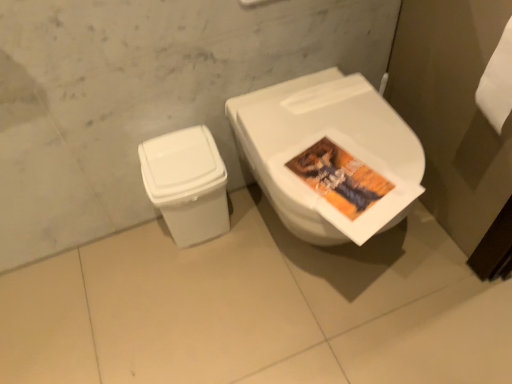
Identify the location of white glossy toilet at center. (329, 155).

Describe the element at coordinates (329, 155) in the screenshot. I see `white glossy toilet at center` at that location.

What do you see at coordinates (187, 183) in the screenshot? The height and width of the screenshot is (384, 512). I see `white plastic trash can at lower left` at bounding box center [187, 183].

In order to face white plastic trash can at lower left, should I rotate leftwards or rightwards?

Turn left by 8.027 degrees to look at white plastic trash can at lower left.

Locate an element on the screen. Image resolution: width=512 pixels, height=384 pixels. white plastic trash can at lower left is located at coordinates pyautogui.click(x=187, y=183).

Identify the location of white glossy toilet at center. This screenshot has width=512, height=384. (329, 155).

Between white glossy toilet at center and white plastic trash can at lower left, which one appears on the right side from the viewer's perspective?

white glossy toilet at center is more to the right.

In the image, is white glossy toilet at center positioned in front of or behind white plastic trash can at lower left?

Visually, white glossy toilet at center is located in front of white plastic trash can at lower left.

Which is in front, point (267, 155) or point (213, 231)?

The point (267, 155) is closer.

From the image's perspective, is white glossy toilet at center located above or below white plastic trash can at lower left?

white glossy toilet at center is situated higher than white plastic trash can at lower left in the image.

From a real-world perspective, who is located higher, white glossy toilet at center or white plastic trash can at lower left?

white glossy toilet at center.

Considering the sizes of white glossy toilet at center and white plastic trash can at lower left in the image, is white glossy toilet at center wider or thinner than white plastic trash can at lower left?

white glossy toilet at center is wider than white plastic trash can at lower left.

Consider the image. Considering the sizes of white glossy toilet at center and white plastic trash can at lower left in the image, is white glossy toilet at center taller or shorter than white plastic trash can at lower left?

white glossy toilet at center is taller than white plastic trash can at lower left.

Can you confirm if white glossy toilet at center is bigger than white plastic trash can at lower left?

Yes, white glossy toilet at center is bigger than white plastic trash can at lower left.

Choose the correct answer: Is white glossy toilet at center inside white plastic trash can at lower left or outside it?

white glossy toilet at center is not enclosed by white plastic trash can at lower left.

Is white glossy toilet at center far from white plastic trash can at lower left?

No, white glossy toilet at center is in close proximity to white plastic trash can at lower left.

From the picture: Is white glossy toilet at center facing away from white plastic trash can at lower left?

No, white glossy toilet at center's orientation is not away from white plastic trash can at lower left.

How different are the orientations of white glossy toilet at center and white plastic trash can at lower left in degrees?

white glossy toilet at center and white plastic trash can at lower left are facing 0.167 degrees away from each other.

The height and width of the screenshot is (384, 512). I want to click on toilet lying in front of the white plastic trash can at lower left, so click(x=329, y=155).

Considering the positions of objects white plastic trash can at lower left and white glossy toilet at center in the image provided, who is more to the right, white plastic trash can at lower left or white glossy toilet at center?

white glossy toilet at center.

Considering the positions of objects white plastic trash can at lower left and white glossy toilet at center in the image provided, who is in front, white plastic trash can at lower left or white glossy toilet at center?

white glossy toilet at center is closer to the camera.

Which is in front, point (217, 200) or point (334, 117)?

The point (334, 117) is closer.

From the image's perspective, is white plastic trash can at lower left under white glossy toilet at center?

Yes, from the image's perspective, white plastic trash can at lower left is below white glossy toilet at center.

From a real-world perspective, which is physically below, white plastic trash can at lower left or white glossy toilet at center?

white plastic trash can at lower left.

Looking at their sizes, would you say white plastic trash can at lower left is wider or thinner than white glossy toilet at center?

A: white plastic trash can at lower left is thinner than white glossy toilet at center.

Is white plastic trash can at lower left taller than white glossy toilet at center?

No.

Considering the relative sizes of white plastic trash can at lower left and white glossy toilet at center in the image provided, is white plastic trash can at lower left bigger than white glossy toilet at center?

No, white plastic trash can at lower left is not bigger than white glossy toilet at center.

Is white plastic trash can at lower left positioned beyond the bounds of white glossy toilet at center?

white plastic trash can at lower left lies outside white glossy toilet at center's area.

Can you see white plastic trash can at lower left touching white glossy toilet at center?

white plastic trash can at lower left and white glossy toilet at center are clearly separated.

In the scene shown: Is white plastic trash can at lower left aimed at white glossy toilet at center?

No, white plastic trash can at lower left is not turned towards white glossy toilet at center.

How many degrees apart are the facing directions of white plastic trash can at lower left and white glossy toilet at center?

The angular difference between white plastic trash can at lower left and white glossy toilet at center is 0.167 degrees.

Locate an element on the screen. The width and height of the screenshot is (512, 384). toilet that is above the white plastic trash can at lower left (from a real-world perspective) is located at coordinates (329, 155).

Identify the location of toilet above the white plastic trash can at lower left (from a real-world perspective). coord(329,155).

Image resolution: width=512 pixels, height=384 pixels. What are the coordinates of `toilet that appears above the white plastic trash can at lower left (from the image's perspective)` in the screenshot? It's located at (329, 155).